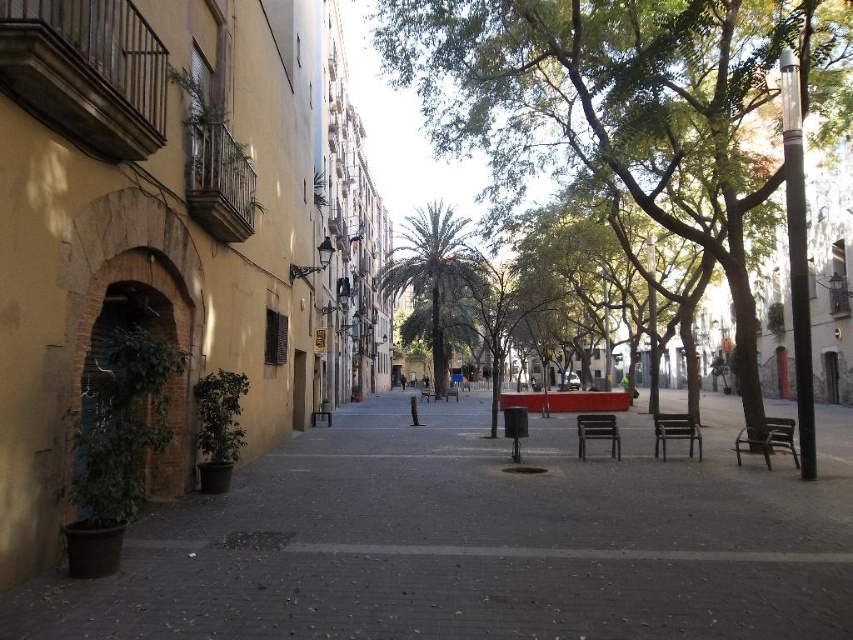
Question: Can you confirm if green leafy palm tree at center is smaller than wooden bench at center?

Choices:
 (A) no
 (B) yes

Answer: (A)

Question: Can you confirm if dark gray concrete pavement at lower left is bigger than brown wooden bench at lower right?

Choices:
 (A) no
 (B) yes

Answer: (B)

Question: Which point is closer to the camera?

Choices:
 (A) (695, 440)
 (B) (788, 438)
 (C) (456, 385)
 (D) (521, 545)

Answer: (D)

Question: Which of the following is the closest to the observer?

Choices:
 (A) (436, 400)
 (B) (614, 132)
 (C) (788, 449)

Answer: (C)

Question: Can you confirm if black plastic bench at center is positioned to the right of wooden bench at center?

Choices:
 (A) yes
 (B) no

Answer: (A)

Question: Which point is farther from the camera taking this photo?

Choices:
 (A) (683, 428)
 (B) (602, 435)
 (C) (772, 436)

Answer: (B)